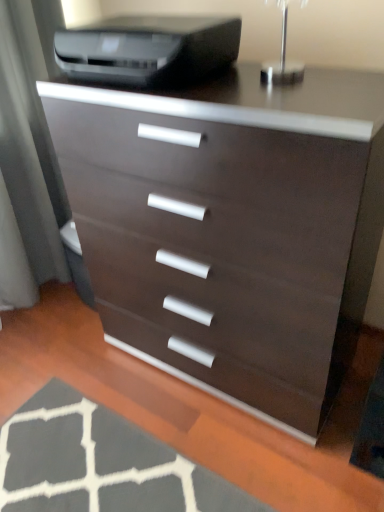
Question: From a real-world perspective, is dark gray textured rug at lower left physically above matte brown chest of drawers at center?

Choices:
 (A) yes
 (B) no

Answer: (B)

Question: Can you confirm if dark gray textured rug at lower left is wider than matte brown chest of drawers at center?

Choices:
 (A) yes
 (B) no

Answer: (A)

Question: Is dark gray textured rug at lower left positioned beyond the bounds of matte brown chest of drawers at center?

Choices:
 (A) yes
 (B) no

Answer: (A)

Question: Considering the relative sizes of dark gray textured rug at lower left and matte brown chest of drawers at center in the image provided, is dark gray textured rug at lower left bigger than matte brown chest of drawers at center?

Choices:
 (A) yes
 (B) no

Answer: (B)

Question: Can you confirm if dark gray textured rug at lower left is smaller than matte brown chest of drawers at center?

Choices:
 (A) yes
 (B) no

Answer: (A)

Question: From a real-world perspective, is dark gray textured rug at lower left beneath matte brown chest of drawers at center?

Choices:
 (A) no
 (B) yes

Answer: (B)

Question: Considering the relative sizes of matte black printer at upper center and matte gray screen door at left in the image provided, is matte black printer at upper center thinner than matte gray screen door at left?

Choices:
 (A) yes
 (B) no

Answer: (B)

Question: From a real-world perspective, is matte black printer at upper center located higher than matte gray screen door at left?

Choices:
 (A) no
 (B) yes

Answer: (B)

Question: From a real-world perspective, is matte black printer at upper center under matte gray screen door at left?

Choices:
 (A) yes
 (B) no

Answer: (B)

Question: Does matte black printer at upper center have a greater height compared to matte gray screen door at left?

Choices:
 (A) no
 (B) yes

Answer: (A)

Question: Is matte black printer at upper center bigger than matte gray screen door at left?

Choices:
 (A) no
 (B) yes

Answer: (A)

Question: From the image's perspective, is matte black printer at upper center on top of matte gray screen door at left?

Choices:
 (A) yes
 (B) no

Answer: (A)

Question: From the image's perspective, is dark gray textured rug at lower left located beneath matte black printer at upper center?

Choices:
 (A) no
 (B) yes

Answer: (B)